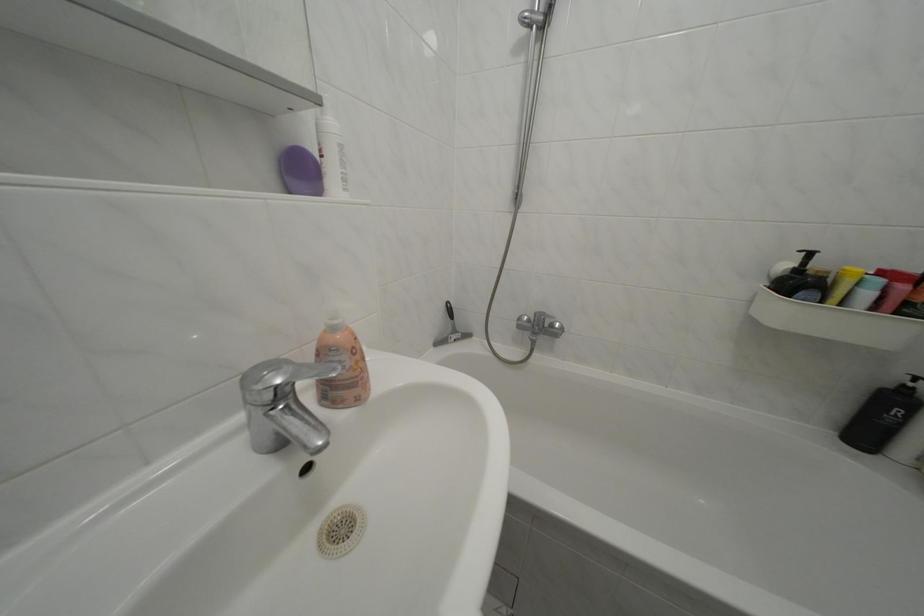
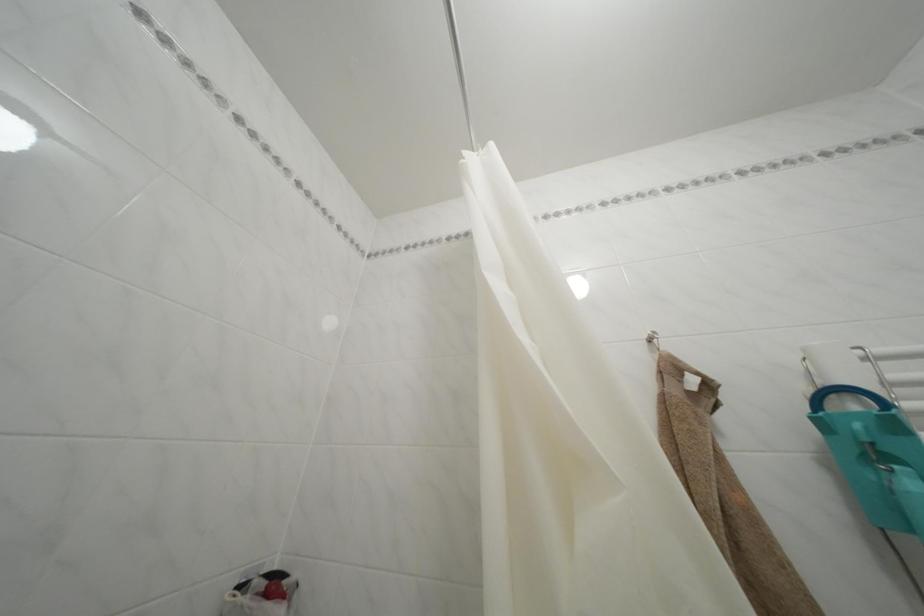
Based on the continuous images, in which direction is the camera rotating?

The camera's rotation is toward right-up.